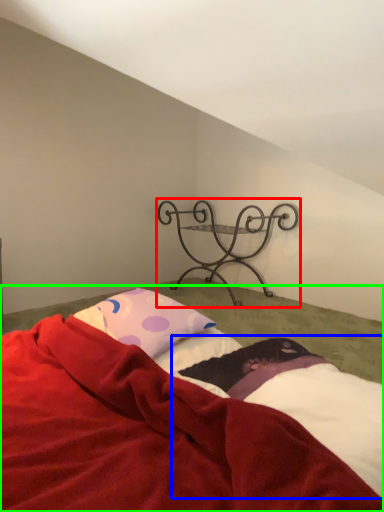
Question: Which object is the closest to the furniture (highlighted by a red box)? Choose among these: sheet (highlighted by a blue box) or bed (highlighted by a green box).

Choices:
 (A) sheet
 (B) bed

Answer: (A)